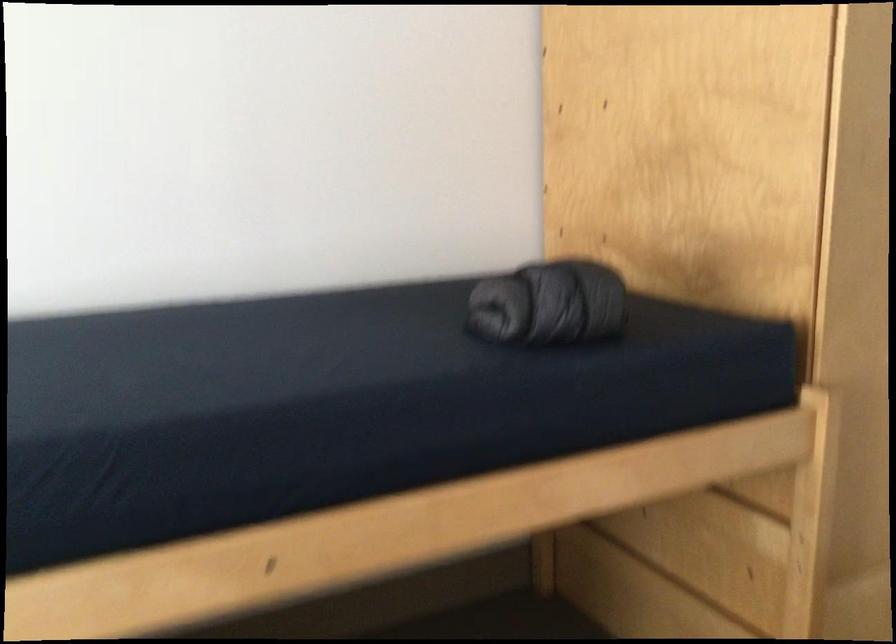
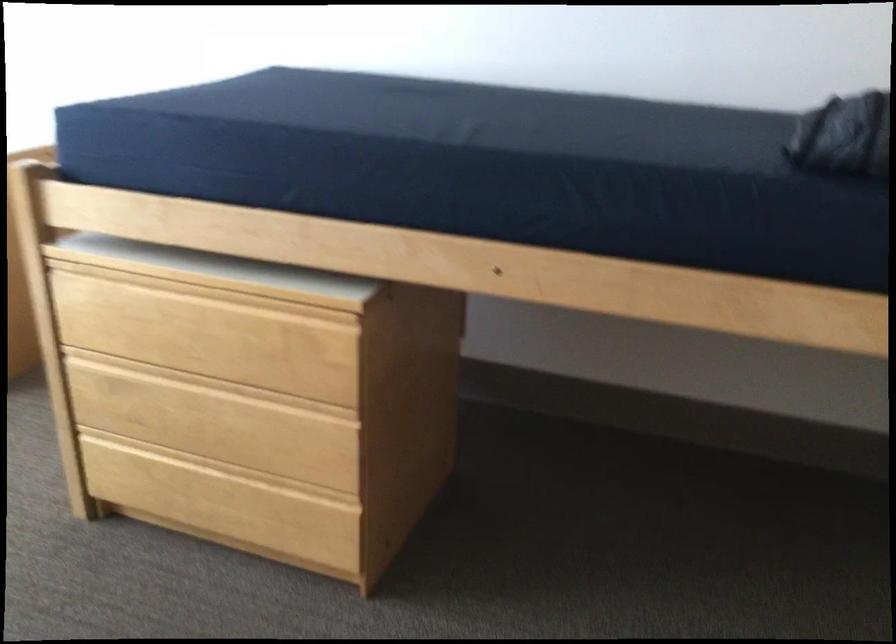
In the scene shown: First-person continuous shooting, in which direction is the camera rotating?

The camera rotated toward left-down.